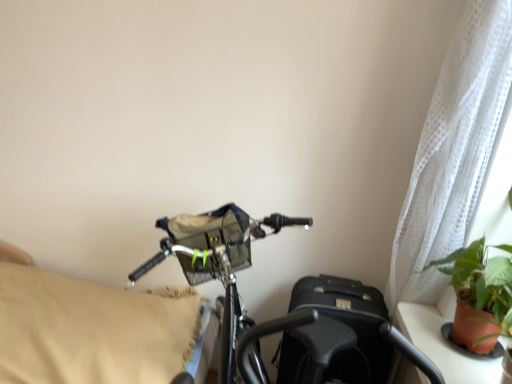
Describe the element at coordinates (453, 152) in the screenshot. I see `white sheer curtain at upper right` at that location.

What is the approximate height of green leafy plant in terracotta pot at right?

green leafy plant in terracotta pot at right is 21.55 inches in height.

Find the location of `beige fabric pillow at left`. beige fabric pillow at left is located at coordinates coord(91,330).

Is white sheer curtain at upper right situated inside green leafy plant in terracotta pot at right or outside?

white sheer curtain at upper right is located beyond the bounds of green leafy plant in terracotta pot at right.

Is point (481, 15) closer to camera compared to point (470, 306)?

Yes, it is in front of point (470, 306).

From a real-world perspective, is white sheer curtain at upper right positioned above or below green leafy plant in terracotta pot at right?

white sheer curtain at upper right is situated higher than green leafy plant in terracotta pot at right in the real world.

Which is closer to the camera, (294, 326) or (508, 262)?

Clearly, point (294, 326) is closer to the camera than point (508, 262).

Is shiny metallic bicycle at center taller than green leafy plant in terracotta pot at right?

Indeed, shiny metallic bicycle at center has a greater height compared to green leafy plant in terracotta pot at right.

Which is more to the right, shiny metallic bicycle at center or green leafy plant in terracotta pot at right?

green leafy plant in terracotta pot at right is more to the right.

Can you tell me how much beige fabric pillow at left and green leafy plant in terracotta pot at right differ in facing direction?

The angle between the facing direction of beige fabric pillow at left and the facing direction of green leafy plant in terracotta pot at right is 1.62 degrees.

Is beige fabric pillow at left positioned in front of green leafy plant in terracotta pot at right?

That is False.

Does beige fabric pillow at left have a lesser height compared to green leafy plant in terracotta pot at right?

No.

Do you think beige fabric pillow at left is within green leafy plant in terracotta pot at right, or outside of it?

beige fabric pillow at left exists outside the volume of green leafy plant in terracotta pot at right.

Can you confirm if green leafy plant in terracotta pot at right is bigger than beige fabric pillow at left?

No.

From a real-world perspective, is green leafy plant in terracotta pot at right on beige fabric pillow at left?

Yes, from a real-world perspective, green leafy plant in terracotta pot at right is above beige fabric pillow at left.

Considering the relative sizes of green leafy plant in terracotta pot at right and beige fabric pillow at left in the image provided, is green leafy plant in terracotta pot at right shorter than beige fabric pillow at left?

Yes.

Is shiny metallic bicycle at center inside green leafy plant in terracotta pot at right?

Actually, shiny metallic bicycle at center is outside green leafy plant in terracotta pot at right.

Is green leafy plant in terracotta pot at right positioned behind shiny metallic bicycle at center?

Yes, green leafy plant in terracotta pot at right is further from the camera.

Who is smaller, green leafy plant in terracotta pot at right or shiny metallic bicycle at center?

With smaller size is green leafy plant in terracotta pot at right.

Locate an element on the screen. Image resolution: width=512 pixels, height=384 pixels. houseplant on the right of shiny metallic bicycle at center is located at coordinates (479, 295).

Would you say white sheer curtain at upper right is inside or outside shiny metallic bicycle at center?

white sheer curtain at upper right is located beyond the bounds of shiny metallic bicycle at center.

Is white sheer curtain at upper right not near shiny metallic bicycle at center?

They are positioned close to each other.

Looking at this image, is white sheer curtain at upper right shorter than shiny metallic bicycle at center?

Incorrect, the height of white sheer curtain at upper right does not fall short of that of shiny metallic bicycle at center.

Is point (480, 98) closer to viewer compared to point (160, 358)?

Yes, point (480, 98) is in front of point (160, 358).

Can you confirm if white sheer curtain at upper right is positioned to the left of beige fabric pillow at left?

No, white sheer curtain at upper right is not to the left of beige fabric pillow at left.

Is white sheer curtain at upper right positioned with its back to beige fabric pillow at left?

white sheer curtain at upper right does not have its back to beige fabric pillow at left.

Is white sheer curtain at upper right not close to beige fabric pillow at left?

Yes, white sheer curtain at upper right is far from beige fabric pillow at left.

Image resolution: width=512 pixels, height=384 pixels. In order to click on curtain above the green leafy plant in terracotta pot at right (from the image's perspective) in this screenshot , I will do `click(453, 152)`.

I want to click on bicycle in front of the green leafy plant in terracotta pot at right, so pyautogui.click(x=288, y=313).

In the scene shown: Which object lies nearer to the anchor point beige fabric pillow at left, white sheer curtain at upper right or green leafy plant in terracotta pot at right?

white sheer curtain at upper right is positioned closer to the anchor beige fabric pillow at left.

Looking at the image, which one is located further to shiny metallic bicycle at center, beige fabric pillow at left or white sheer curtain at upper right?

white sheer curtain at upper right is positioned further to the anchor shiny metallic bicycle at center.

Which object lies further to the anchor point green leafy plant in terracotta pot at right, white sheer curtain at upper right or shiny metallic bicycle at center?

Among the two, shiny metallic bicycle at center is located further to green leafy plant in terracotta pot at right.

Based on their spatial positions, is white sheer curtain at upper right or shiny metallic bicycle at center further from beige fabric pillow at left?

white sheer curtain at upper right.

Based on the photo, based on their spatial positions, is beige fabric pillow at left or green leafy plant in terracotta pot at right closer to white sheer curtain at upper right?

green leafy plant in terracotta pot at right lies closer to white sheer curtain at upper right than the other object.

Considering their positions, is beige fabric pillow at left positioned further to shiny metallic bicycle at center than green leafy plant in terracotta pot at right?

green leafy plant in terracotta pot at right is positioned further to the anchor shiny metallic bicycle at center.

From the image, which object appears to be nearer to green leafy plant in terracotta pot at right, white sheer curtain at upper right or beige fabric pillow at left?

Among the two, white sheer curtain at upper right is located nearer to green leafy plant in terracotta pot at right.

Estimate the real-world distances between objects in this image. Which object is closer to green leafy plant in terracotta pot at right, beige fabric pillow at left or white sheer curtain at upper right?

white sheer curtain at upper right lies closer to green leafy plant in terracotta pot at right than the other object.

This screenshot has height=384, width=512. Find the location of `curtain between beige fabric pillow at left and green leafy plant in terracotta pot at right`. curtain between beige fabric pillow at left and green leafy plant in terracotta pot at right is located at coordinates (453, 152).

In order to click on bicycle situated between beige fabric pillow at left and white sheer curtain at upper right from left to right in this screenshot , I will do `click(288, 313)`.

Find the location of a particular element. This screenshot has height=384, width=512. houseplant that lies between white sheer curtain at upper right and shiny metallic bicycle at center from top to bottom is located at coordinates (479, 295).

Where is `bicycle between beige fabric pillow at left and green leafy plant in terracotta pot at right`? The height and width of the screenshot is (384, 512). bicycle between beige fabric pillow at left and green leafy plant in terracotta pot at right is located at coordinates [288, 313].